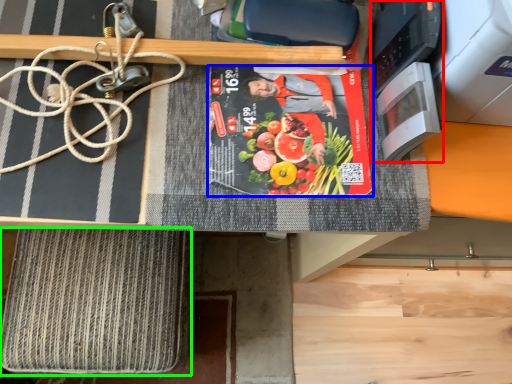
Question: Which is nearer to the appliance (highlighted by a red box)? paperback book (highlighted by a blue box) or yoga mat (highlighted by a green box).

Choices:
 (A) paperback book
 (B) yoga mat

Answer: (A)